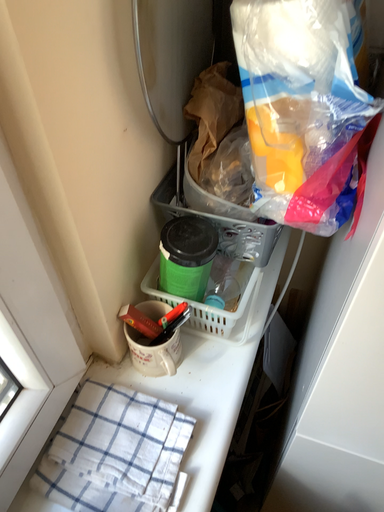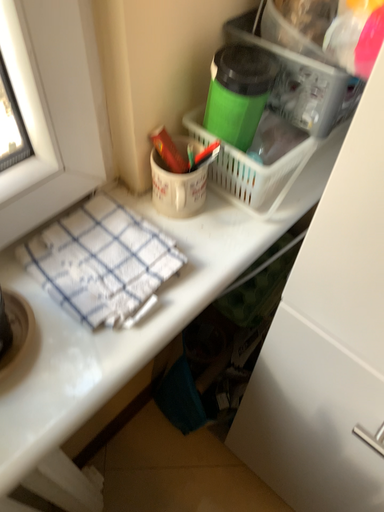
Question: How did the camera likely rotate when shooting the video?

Choices:
 (A) rotated right
 (B) rotated left

Answer: (B)